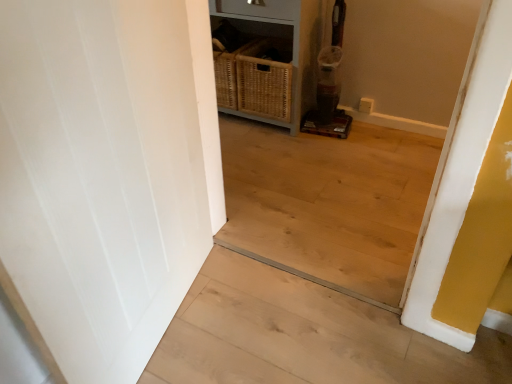
What do you see at coordinates (304, 336) in the screenshot?
I see `white wood stairwell at left` at bounding box center [304, 336].

Identify the location of white wood stairwell at left. (304, 336).

You are a GUI agent. You are given a task and a screenshot of the screen. Output one action in this format:
    pyautogui.click(x=<x>, y=<y>)
    Task: Click on the woven wood dresser at center
    The width and height of the screenshot is (512, 384).
    Given the screenshot: What is the action you would take?
    pyautogui.click(x=266, y=63)

Describe the element at coordinates (266, 63) in the screenshot. I see `woven wood dresser at center` at that location.

This screenshot has height=384, width=512. Identify the location of white wood stairwell at left. (304, 336).

Considering the positions of objects white wood stairwell at left and woven wood dresser at center in the image provided, who is more to the left, white wood stairwell at left or woven wood dresser at center?

Positioned to the left is woven wood dresser at center.

Which object is closer to the camera taking this photo, white wood stairwell at left or woven wood dresser at center?

white wood stairwell at left.

Which is closer to the camera, (191, 360) or (287, 66)?

Point (191, 360)

From the image's perspective, between white wood stairwell at left and woven wood dresser at center, who is located below?

white wood stairwell at left, from the image's perspective.

From a real-world perspective, between white wood stairwell at left and woven wood dresser at center, who is vertically lower?

white wood stairwell at left.

Which object is thinner, white wood stairwell at left or woven wood dresser at center?

With smaller width is woven wood dresser at center.

Considering the relative sizes of white wood stairwell at left and woven wood dresser at center in the image provided, is white wood stairwell at left shorter than woven wood dresser at center?

Correct, white wood stairwell at left is not as tall as woven wood dresser at center.

Considering the sizes of white wood stairwell at left and woven wood dresser at center in the image, is white wood stairwell at left bigger or smaller than woven wood dresser at center?

Considering their sizes, white wood stairwell at left takes up less space than woven wood dresser at center.

Is woven wood dresser at center completely or partially inside white wood stairwell at left?

No, woven wood dresser at center is not a part of white wood stairwell at left.

Is white wood stairwell at left next to woven wood dresser at center?

No.

Is white wood stairwell at left positioned with its back to woven wood dresser at center?

No, white wood stairwell at left is not facing the opposite direction of woven wood dresser at center.

Identify the location of stairwell to the right of woven wood dresser at center. This screenshot has height=384, width=512. (304, 336).

Which is more to the left, woven wood dresser at center or white wood stairwell at left?

Positioned to the left is woven wood dresser at center.

Considering their positions, is woven wood dresser at center located in front of or behind white wood stairwell at left?

Clearly, woven wood dresser at center is behind white wood stairwell at left.

Which is closer, [298,24] or [437,362]?

Point [298,24].

From the image's perspective, is woven wood dresser at center beneath white wood stairwell at left?

Actually, woven wood dresser at center appears above white wood stairwell at left in the image.

From a real-world perspective, is woven wood dresser at center positioned over white wood stairwell at left based on gravity?

Correct, in the physical world, woven wood dresser at center is higher than white wood stairwell at left.

Looking at this image, considering the sizes of objects woven wood dresser at center and white wood stairwell at left in the image provided, who is thinner, woven wood dresser at center or white wood stairwell at left?

woven wood dresser at center.

Does woven wood dresser at center have a lesser height compared to white wood stairwell at left?

Incorrect, the height of woven wood dresser at center does not fall short of that of white wood stairwell at left.

Who is bigger, woven wood dresser at center or white wood stairwell at left?

woven wood dresser at center is bigger.

Would you say woven wood dresser at center is inside or outside white wood stairwell at left?

woven wood dresser at center cannot be found inside white wood stairwell at left.

Can you see woven wood dresser at center touching white wood stairwell at left?

No, woven wood dresser at center is not next to white wood stairwell at left.

Is woven wood dresser at center facing away from white wood stairwell at left?

No, woven wood dresser at center is not facing away from white wood stairwell at left.

How many degrees apart are the facing directions of woven wood dresser at center and white wood stairwell at left?

woven wood dresser at center and white wood stairwell at left are facing 179 degrees away from each other.

Where is `stairwell in front of the woven wood dresser at center`? The height and width of the screenshot is (384, 512). stairwell in front of the woven wood dresser at center is located at coordinates (304, 336).

The image size is (512, 384). Find the location of `stairwell on the right of the woven wood dresser at center`. stairwell on the right of the woven wood dresser at center is located at coordinates (304, 336).

I want to click on dresser located on the left of white wood stairwell at left, so click(x=266, y=63).